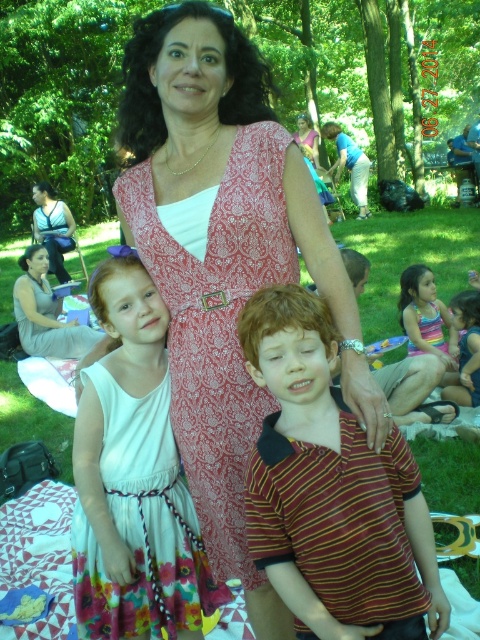
Question: Is patterned fabric dress at center above white floral dress at center?

Choices:
 (A) no
 (B) yes

Answer: (B)

Question: Which of the following is the farthest from the observer?

Choices:
 (A) (408, 301)
 (B) (178, 528)

Answer: (A)

Question: Is white cotton dress at lower right positioned in front of matte black tank top at upper left?

Choices:
 (A) no
 (B) yes

Answer: (B)

Question: Estimate the real-world distances between objects in this image. Which object is farther from the red printed fabric dress at center?

Choices:
 (A) striped fabric dress at lower left
 (B) white floral dress at center
 (C) matte gray dress at center

Answer: (C)

Question: Can you confirm if white floral dress at center is positioned to the right of multicolored fabric dress at center?

Choices:
 (A) yes
 (B) no

Answer: (B)

Question: Among these objects, which one is nearest to the camera?

Choices:
 (A) white cotton dress at lower right
 (B) multicolored fabric dress at center
 (C) striped fabric dress at lower left

Answer: (C)